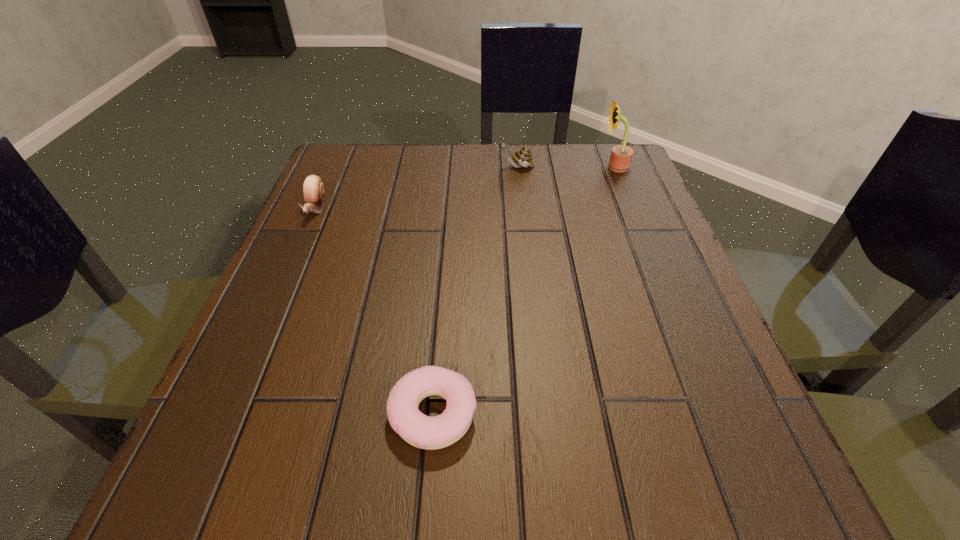
At what (x,y) coordinates should I click in order to perform the action: click on object that is the third closest to the shorter escargot. Please return your answer as a coordinate pair (x, y). The image size is (960, 540). Looking at the image, I should click on (621, 155).

At what (x,y) coordinates should I click in order to perform the action: click on vacant space that satisfies the following two spatial constraints: 1. on the front-facing side of the doughnut; 2. on the right side of the left escargot. Please return your answer as a coordinate pair (x, y). This screenshot has height=540, width=960. Looking at the image, I should click on (225, 414).

The height and width of the screenshot is (540, 960). Find the location of `blank area in the image that satisfies the following two spatial constraints: 1. on the front-facing side of the second object from left to right; 2. on the left side of the third farthest object`. blank area in the image that satisfies the following two spatial constraints: 1. on the front-facing side of the second object from left to right; 2. on the left side of the third farthest object is located at coordinates (225, 414).

Identify the location of free space that satisfies the following two spatial constraints: 1. on the front-facing side of the nearest object; 2. on the left side of the shorter escargot. (225, 414).

Where is `free location that satisfies the following two spatial constraints: 1. on the face of the sunflower; 2. on the front-facing side of the nearer escargot`? The height and width of the screenshot is (540, 960). free location that satisfies the following two spatial constraints: 1. on the face of the sunflower; 2. on the front-facing side of the nearer escargot is located at coordinates (631, 208).